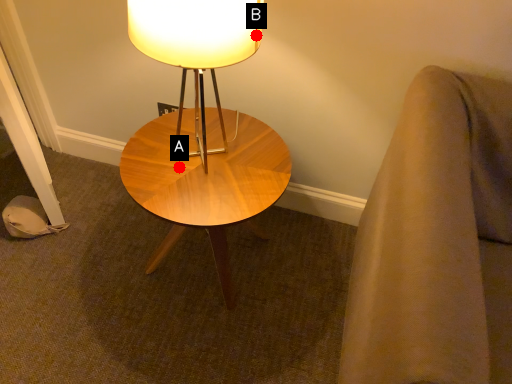
Question: Two points are circled on the image, labeled by A and B beside each circle. Which point is closer to the camera?

Choices:
 (A) A is closer
 (B) B is closer

Answer: (B)